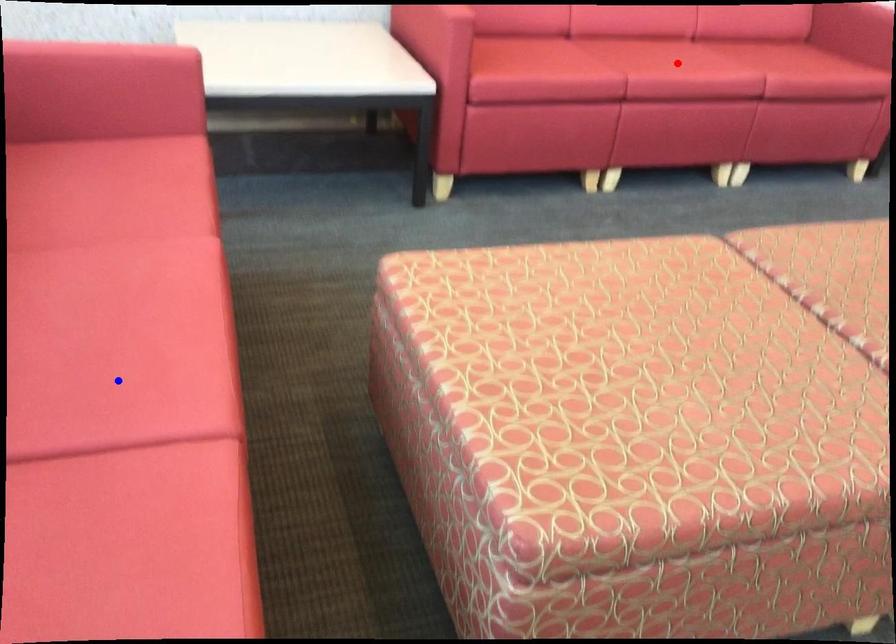
Question: In the image, two points are highlighted. Which point is nearer to the camera? Reply with the corresponding letter.

Choices:
 (A) blue point
 (B) red point

Answer: (A)